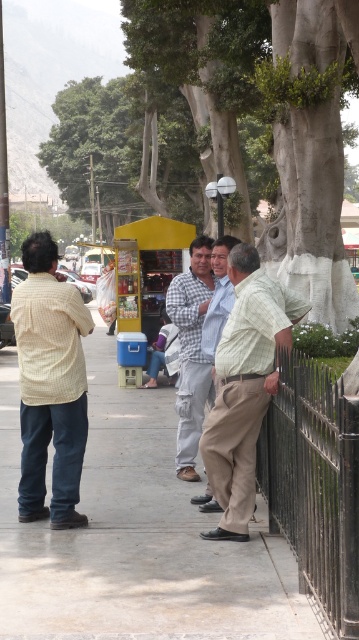
Question: Which of the following is the closest to the observer?

Choices:
 (A) (246, 492)
 (B) (231, 285)

Answer: (A)

Question: Does checkered fabric shirt at center come behind light blue shirt at center?

Choices:
 (A) no
 (B) yes

Answer: (B)

Question: Which of the following is the farthest from the observer?

Choices:
 (A) light blue shirt at center
 (B) light yellow checkered shirt at left
 (C) concrete sidewalk at center
 (D) checkered fabric shirt at center

Answer: (D)

Question: Is black wrought iron fence at lower right bigger than light yellow checkered shirt at left?

Choices:
 (A) no
 (B) yes

Answer: (A)

Question: Is light yellow checkered shirt at left positioned at the back of light blue shirt at center?

Choices:
 (A) yes
 (B) no

Answer: (B)

Question: Based on their relative distances, which object is nearer to the checkered fabric shirt at center?

Choices:
 (A) khaki pants at center
 (B) black wrought iron fence at lower right
 (C) light yellow checkered shirt at left

Answer: (C)